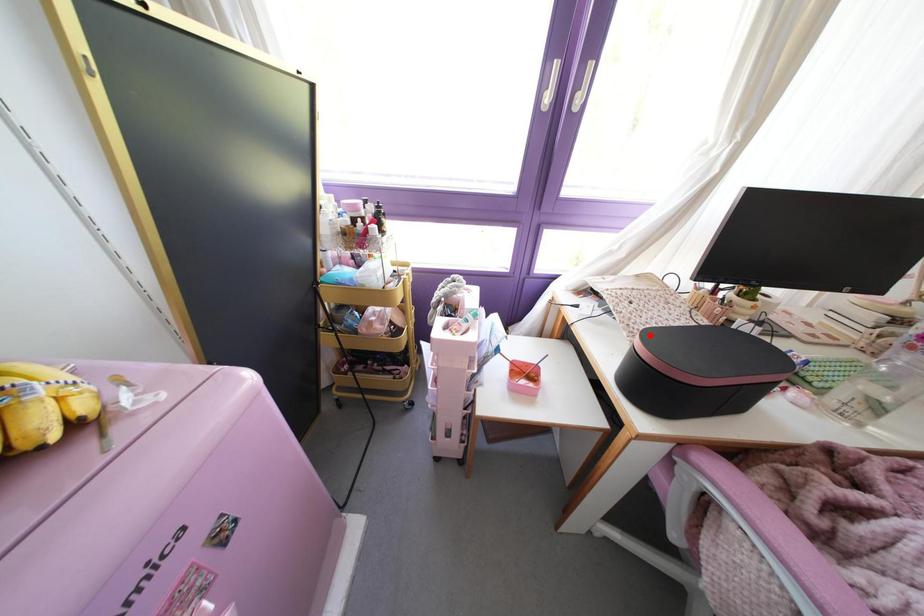
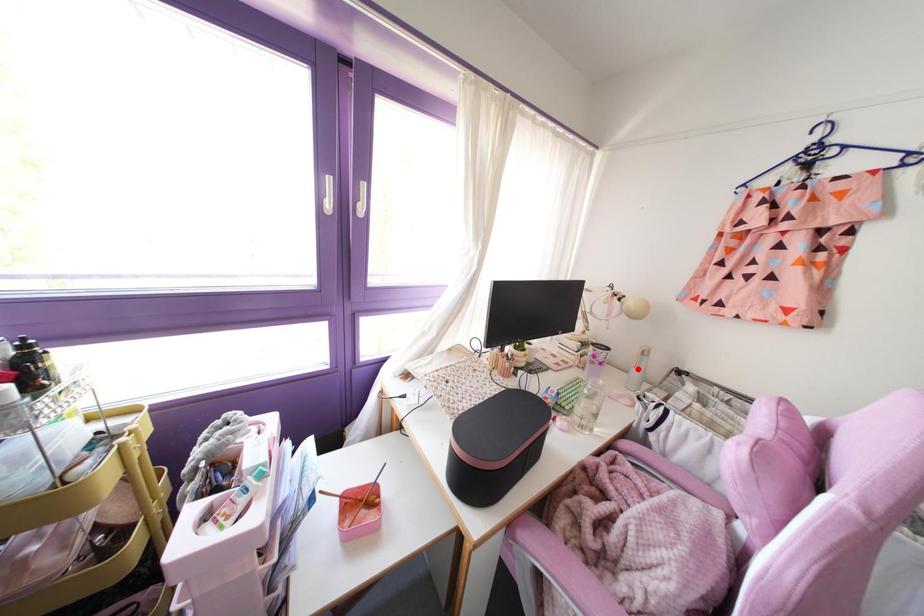
I am providing you with two images of the same scene from different viewpoints. A red point is marked on the first image and another point is marked on the second image. Do the highlighted points in image1 and image2 indicate the same real-world spot?

No